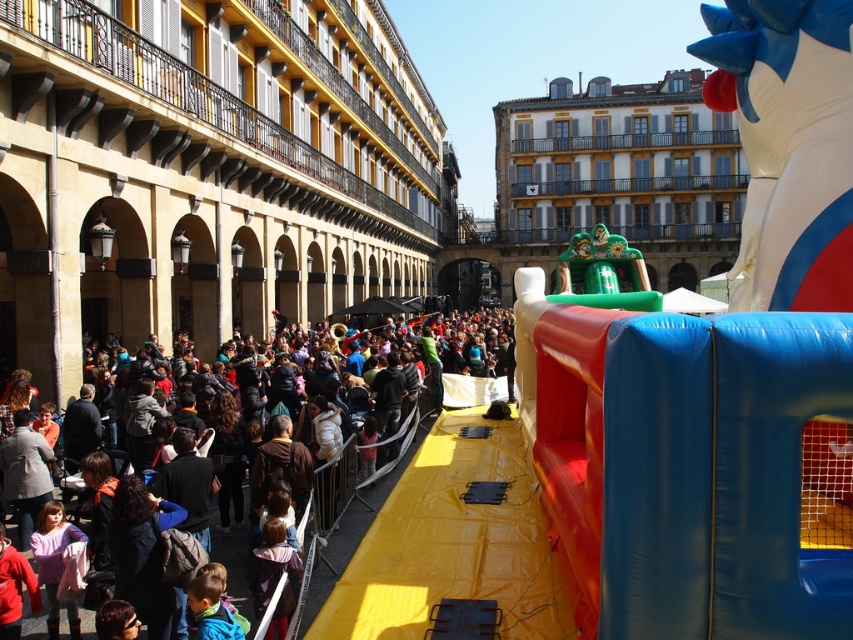
Question: Does multicolored fabric crowd at center have a lesser width compared to light brown fabric jacket at center?

Choices:
 (A) no
 (B) yes

Answer: (A)

Question: Which of the following is the closest to the observer?

Choices:
 (A) light brown hair at lower center
 (B) multicolored fabric crowd at center

Answer: (B)

Question: Which point is closer to the camera?

Choices:
 (A) multicolored fabric crowd at center
 (B) light brown hair at lower center

Answer: (A)

Question: Which point appears farthest from the camera in this image?

Choices:
 (A) (41, 637)
 (B) (363, 442)

Answer: (B)

Question: Is multicolored fabric crowd at center behind light brown hair at lower center?

Choices:
 (A) yes
 (B) no

Answer: (B)

Question: Does multicolored fabric crowd at center come behind light brown hair at lower center?

Choices:
 (A) yes
 (B) no

Answer: (B)